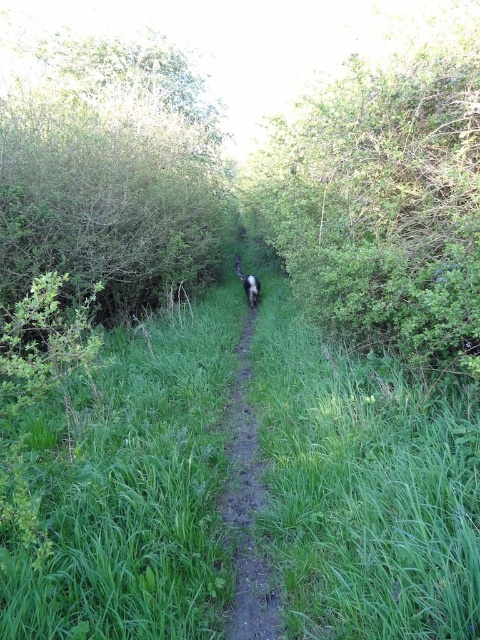
Which is below, green grassy at center or black fur dog at center?

green grassy at center

Which is more to the left, green grassy at center or black fur dog at center?

black fur dog at center is more to the left.

At what (x,y) coordinates should I click in order to perform the action: click on green grassy at center. Please return your answer as a coordinate pair (x, y). The image size is (480, 640). Looking at the image, I should click on (363, 486).

Which is in front, point (243, 630) or point (252, 284)?

Point (243, 630) is more forward.

Can you confirm if dirt path at center is shorter than black fur dog at center?

Incorrect, dirt path at center's height does not fall short of black fur dog at center's.

What do you see at coordinates (247, 499) in the screenshot?
I see `dirt path at center` at bounding box center [247, 499].

I want to click on dirt path at center, so click(247, 499).

Is point (303, 438) closer to viewer compared to point (247, 554)?

No, it is not.

Can you confirm if green grassy at center is positioned to the right of dirt path at center?

Indeed, green grassy at center is positioned on the right side of dirt path at center.

Which is in front, point (29, 436) or point (233, 435)?

Point (29, 436)

I want to click on green grassy at center, so click(363, 486).